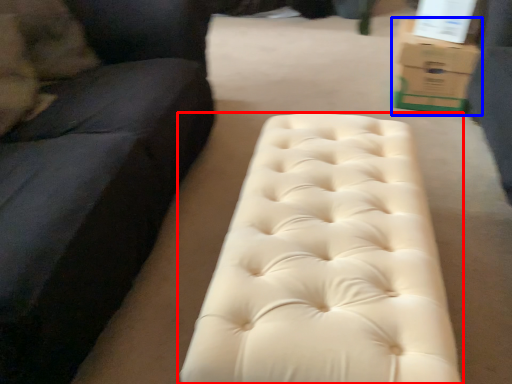
Question: Among these objects, which one is nearest to the camera, furniture (highlighted by a red box) or cardboard box (highlighted by a blue box)?

Choices:
 (A) furniture
 (B) cardboard box

Answer: (A)